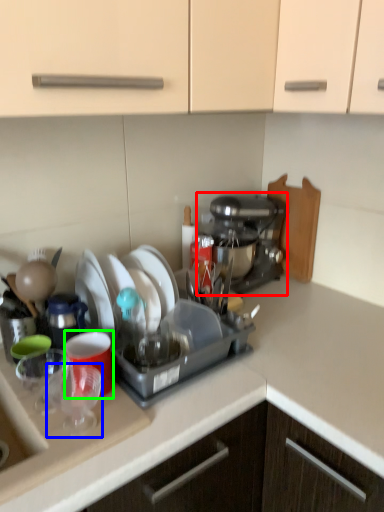
Question: Considering the real-world distances, which object is closest to coffee maker (highlighted by a red box)? tableware (highlighted by a blue box) or coffee cup (highlighted by a green box).

Choices:
 (A) tableware
 (B) coffee cup

Answer: (B)